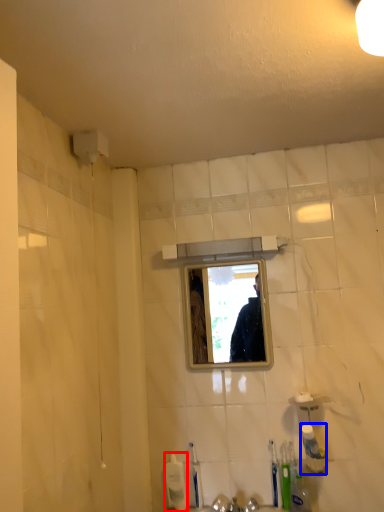
Question: Which point is further to the camera, toiletry (highlighted by a red box) or toiletry (highlighted by a blue box)?

Choices:
 (A) toiletry
 (B) toiletry

Answer: (A)